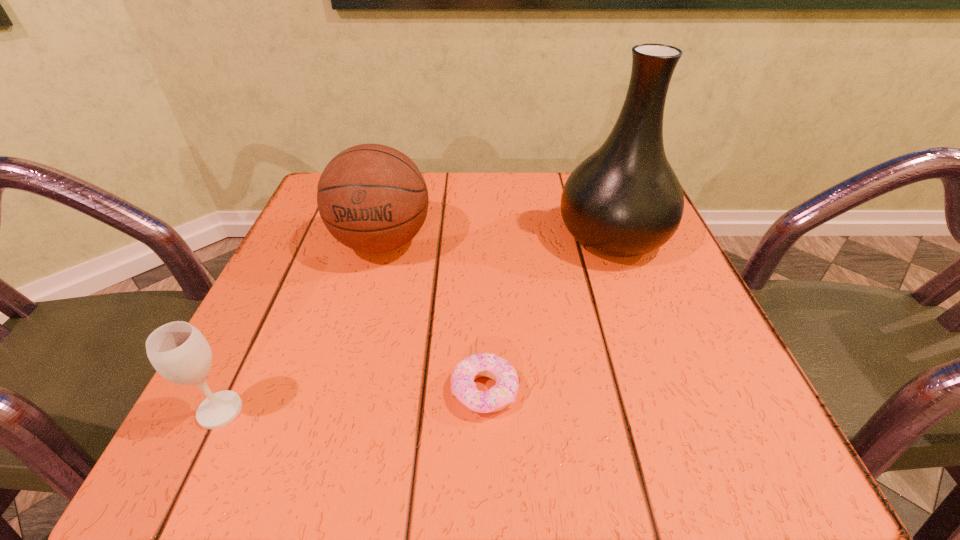
Image resolution: width=960 pixels, height=540 pixels. Identify the location of the tallest object. (624, 200).

You are a GUI agent. You are given a task and a screenshot of the screen. Output one action in this format:
    pyautogui.click(x=<x>, y=<y>)
    Task: Click on the vase
    This screenshot has width=960, height=540.
    Given the screenshot: What is the action you would take?
    pyautogui.click(x=624, y=200)

Image resolution: width=960 pixels, height=540 pixels. Identify the location of the third object from right to left. pyautogui.click(x=372, y=198).

The height and width of the screenshot is (540, 960). Identify the location of basketball. (372, 198).

Identify the location of the leftmost object. tap(178, 351).

At what (x,y) coordinates should I click in order to perform the action: click on wineglass. Please return your answer as a coordinate pair (x, y). Image resolution: width=960 pixels, height=540 pixels. Looking at the image, I should click on (178, 351).

Find the location of a particular element. Image resolution: width=960 pixels, height=540 pixels. the second object from right to left is located at coordinates (463, 387).

Locate an element on the screen. The height and width of the screenshot is (540, 960). the shortest object is located at coordinates (463, 387).

The width and height of the screenshot is (960, 540). I want to click on free spot located 0.340m on the left of the tallest object, so click(x=386, y=237).

Locate an element on the screen. The width and height of the screenshot is (960, 540). vacant space located 0.260m on the side with brand label of the basketball is located at coordinates (339, 403).